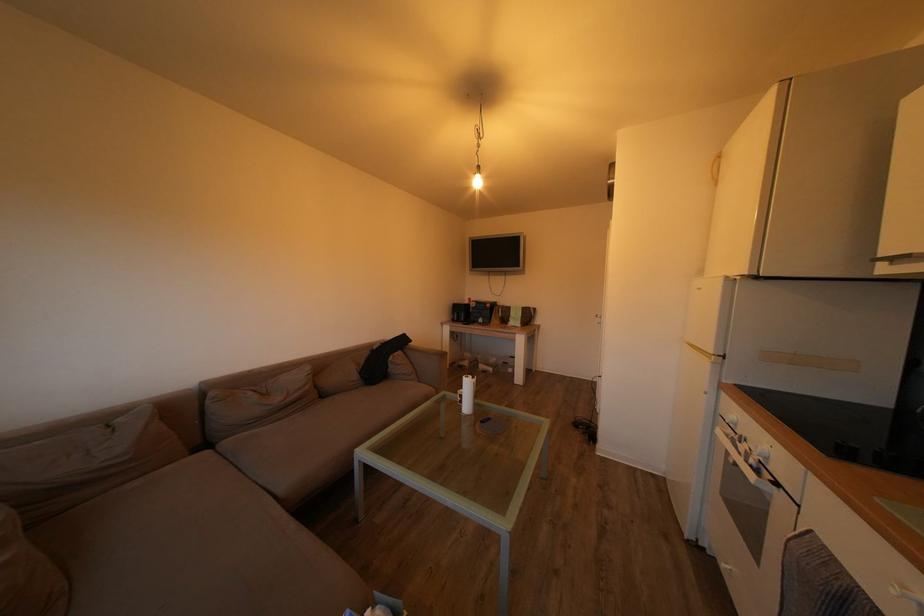
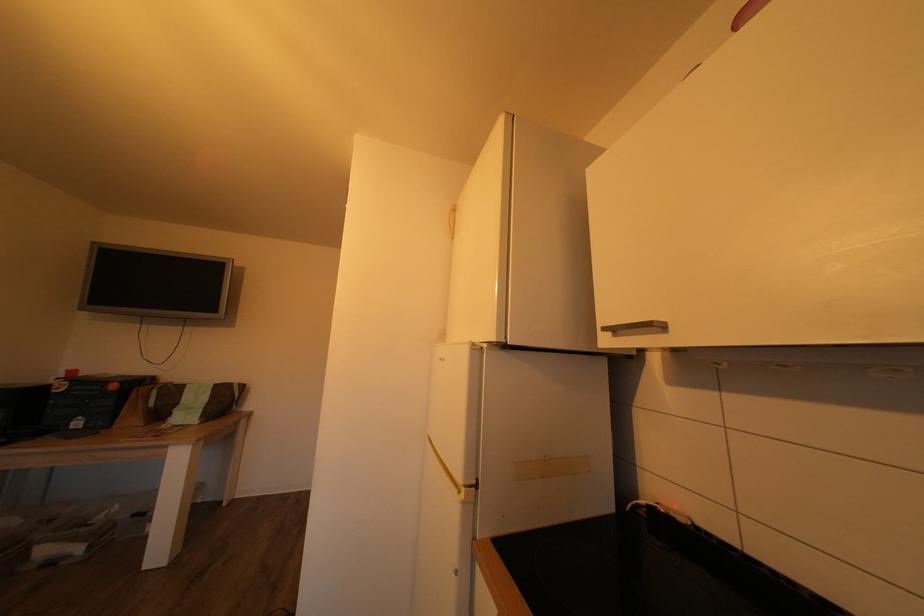
Question: The first image is from the beginning of the video and the second image is from the end. How did the camera likely rotate when shooting the video?

Choices:
 (A) Left
 (B) Right
 (C) Up
 (D) Down

Answer: (B)